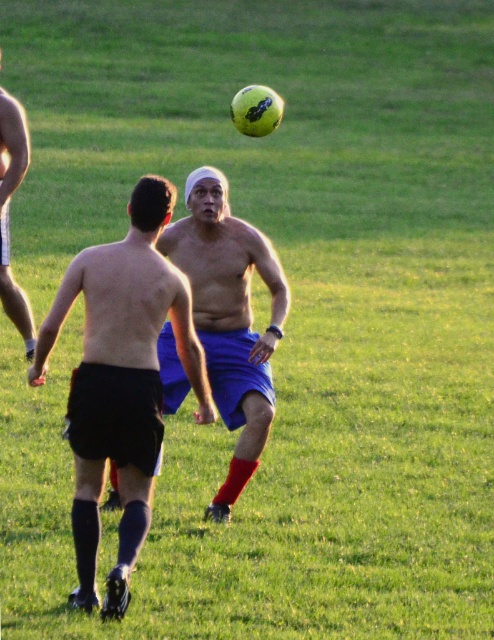
You are a soccer coach analyzing the game from the sidelines. You notice the blue fabric shorts at center and the shiny black shorts at left. Which player is positioned closer to the front of the field between these two?

The blue fabric shorts at center is located below shiny black shorts at left, meaning the player in the blue fabric shorts at center is positioned closer to the front of the field.

You are a soccer player standing at point (x=122, y=380). You need to pass the ball to your teammate who is wearing blue shorts at center. Which direction should you pass the ball?

The shiny blue shorts at center is located at point (x=122, y=380), so you are already at the same position as the teammate wearing blue shorts at center. You might need to check the location again or choose a different teammate.

What is located at the coordinates point (122, 380)?

The coordinates point (122, 380) are occupied by shiny blue shorts at center.